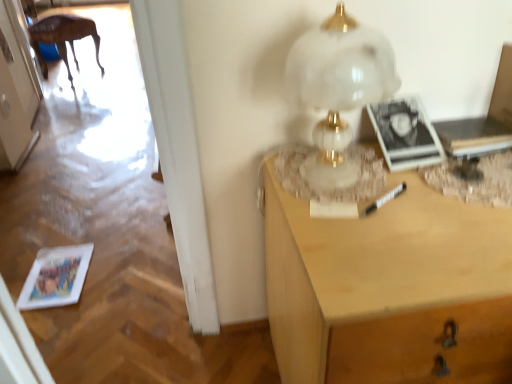
Where is `empty space that is ontop of light wood desk at right (from a real-world perspective)`? empty space that is ontop of light wood desk at right (from a real-world perspective) is located at coordinates (422, 205).